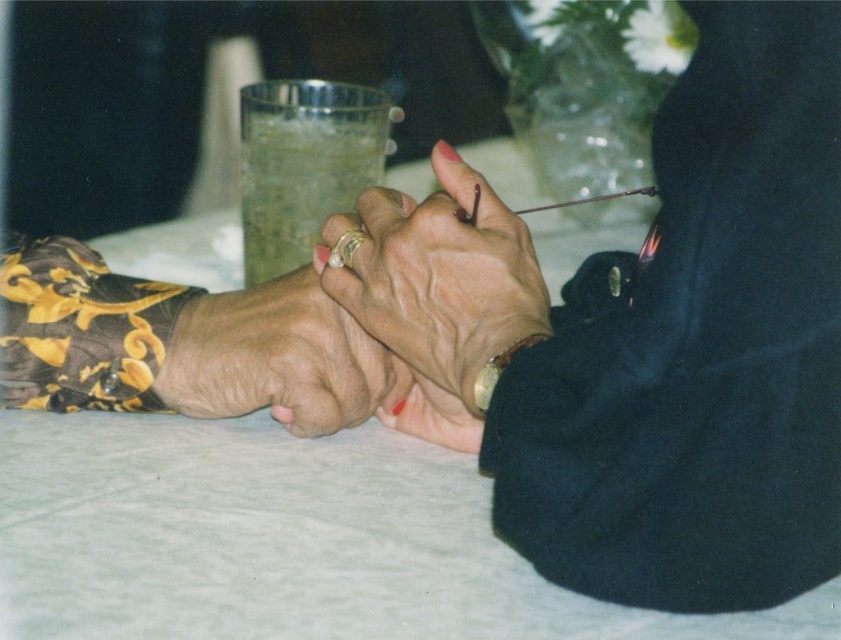
What is the 2D coordinate of the matte gold ring at center?

The 2D coordinate of the matte gold ring at center is at point (438, 278).

You are a photographer adjusting the lighting for a photo shoot. The scene includes a glass of water and two hands on a table. You need to place a spotlight exactly at point (653, 337). According to the image description, where should you position the spotlight?

The point (653, 337) is on the smooth black sweater at center, so you should position the spotlight on the smooth black sweater at center.

You are a photographer adjusting your camera to focus on two points in the image. The points are labeled as point (339, 296) and point (315, 429). Based on their positions, which point should you focus on first to ensure the closest object is in sharp focus?

Point (339, 296) is closer to the viewer than point (315, 429), so you should focus on point (339, 296) first to capture the closest object in sharp focus.